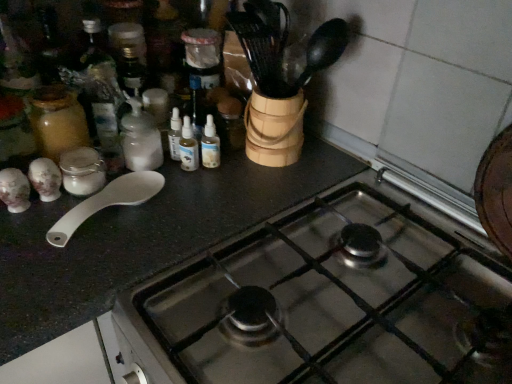
Question: From the image's perspective, is stainless steel gas stove at center positioned above or below white matte bottle at center-left?

Choices:
 (A) above
 (B) below

Answer: (B)

Question: Considering the positions of point (276, 284) and point (120, 140), is point (276, 284) closer or farther from the camera than point (120, 140)?

Choices:
 (A) closer
 (B) farther

Answer: (A)

Question: Estimate the real-world distances between objects in this image. Which object is closer to the white plastic spoon at left?

Choices:
 (A) white matte bottle at center-left
 (B) stainless steel gas stove at center

Answer: (A)

Question: Estimate the real-world distances between objects in this image. Which object is farther from the white matte bottle at center-left?

Choices:
 (A) stainless steel gas stove at center
 (B) white plastic spoon at left

Answer: (A)